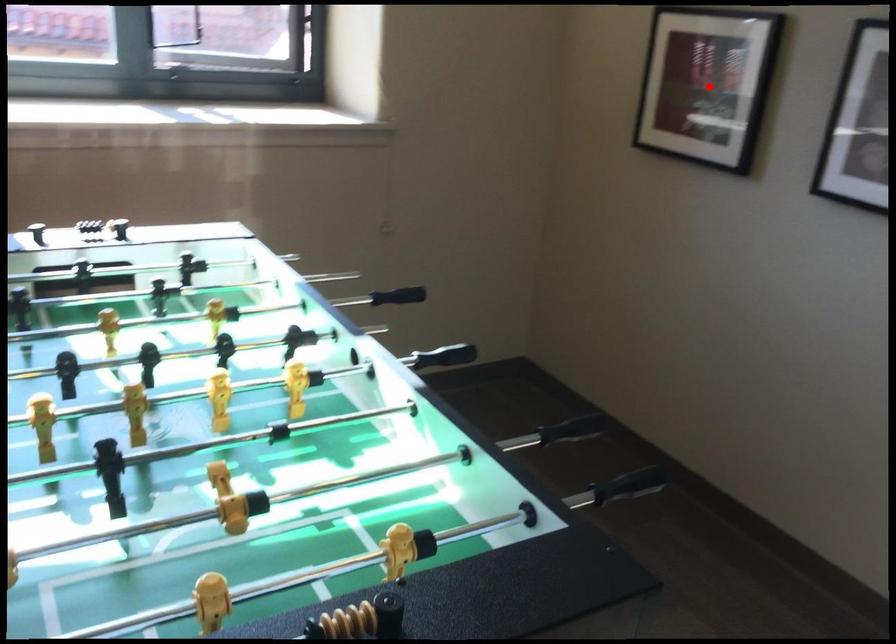
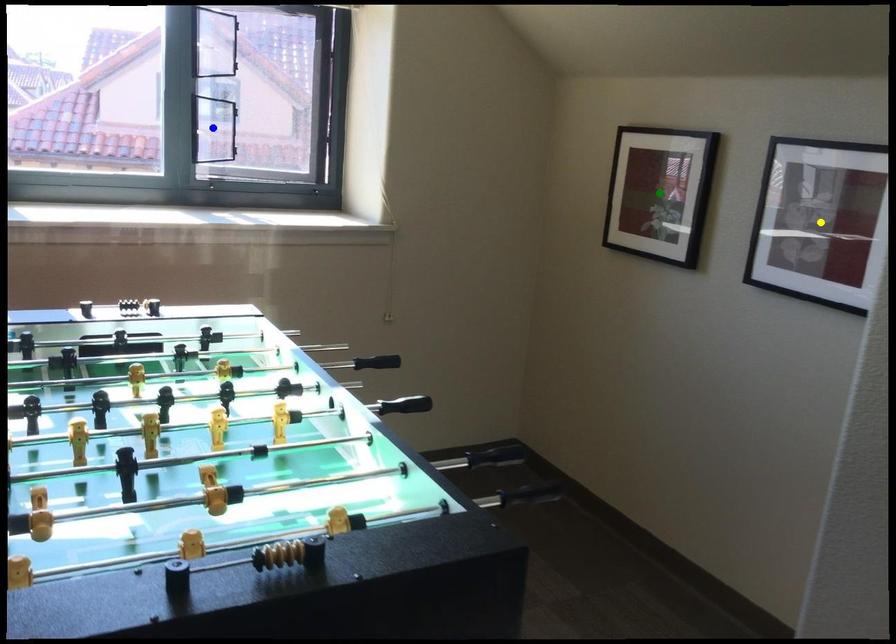
Question: I am providing you with two images of the same scene from different viewpoints. A red point is marked on the first image. You are given multiple points on the second image. Which point in image 2 is actually the same real-world point as the red point in image 1?

Choices:
 (A) green point
 (B) yellow point
 (C) blue point

Answer: (A)